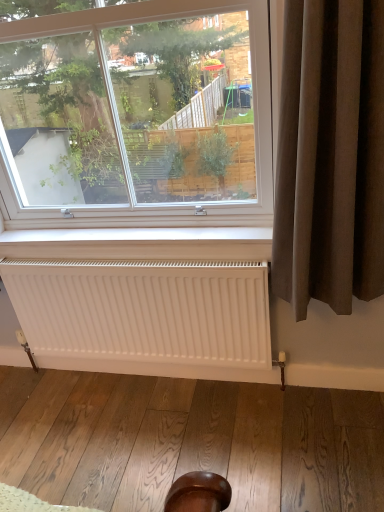
Identify the location of blank area beneath white matte radiator at lower center (from a real-world perspective). The width and height of the screenshot is (384, 512). (142, 379).